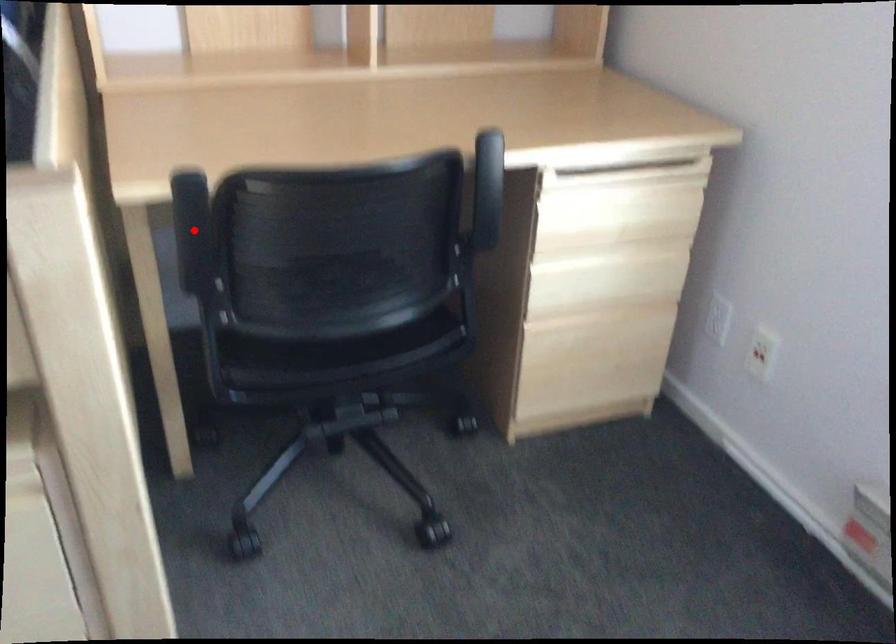
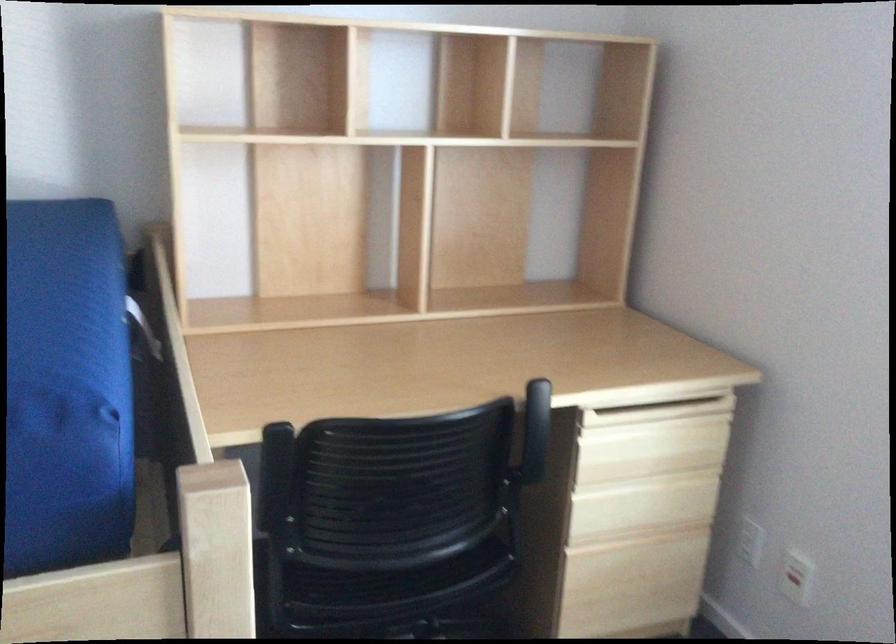
Locate, in the second image, the point that corresponds to the highlighted location in the first image.

(273, 474)